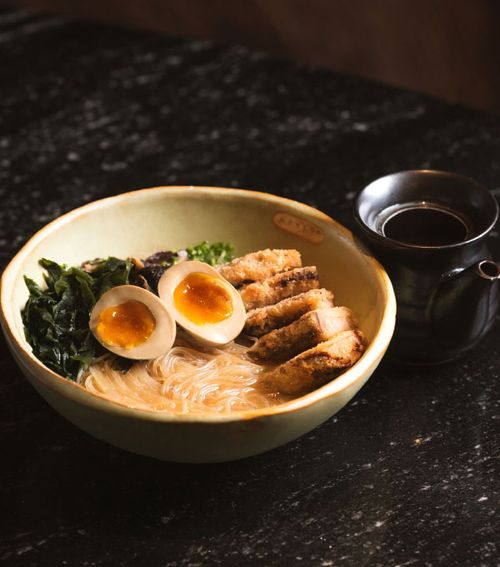
I want to click on plate, so click(323, 408).